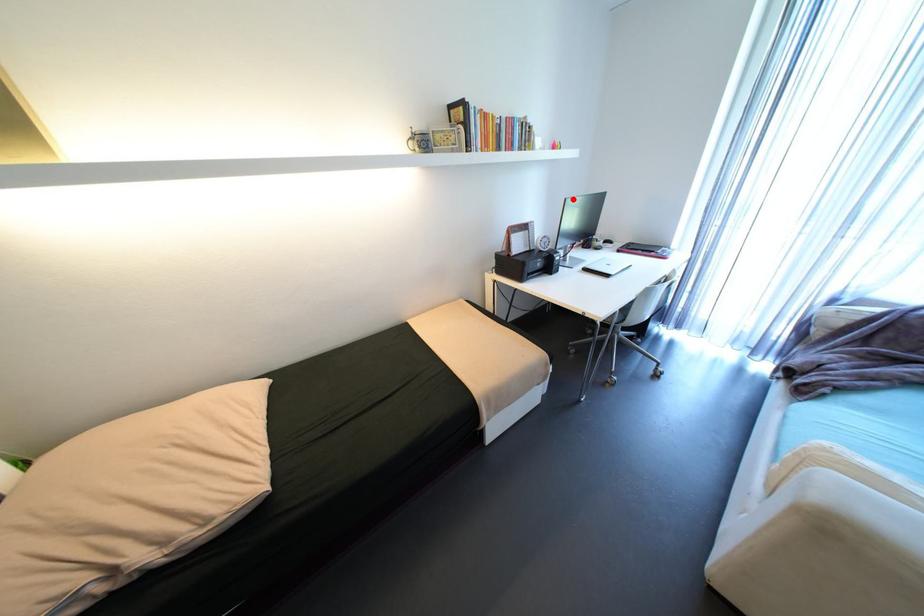
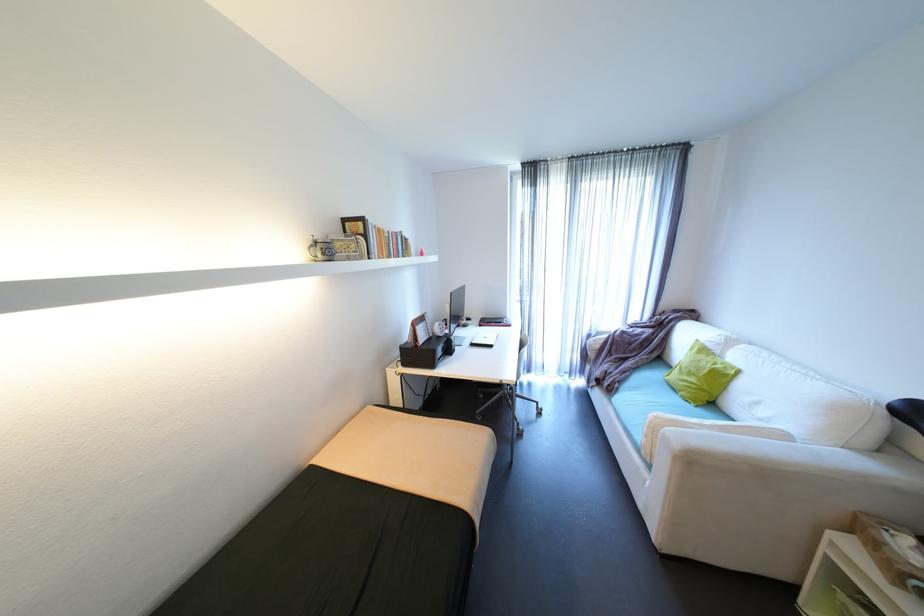
The point at the highlighted location is marked in the first image. Where is the corresponding point in the second image?

(458, 294)